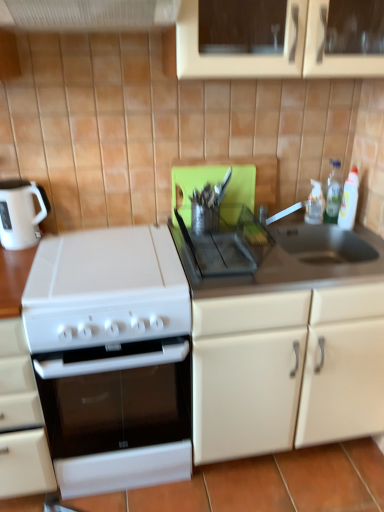
Question: Is point (1, 367) closer or farther from the camera than point (205, 423)?

Choices:
 (A) closer
 (B) farther

Answer: (A)

Question: Is white matte oven at lower left, the 1th cabinetry viewed from the left, inside the boundaries of white matte cabinet at right, positioned as the 1th cabinetry in right-to-left order, or outside?

Choices:
 (A) outside
 (B) inside

Answer: (A)

Question: Which of these objects is positioned closest to the white glossy gas stove at left, the second gas stove positioned from the top?

Choices:
 (A) white matte cabinet at right, positioned as the 1th cabinetry in right-to-left order
 (B) clear plastic bottle at upper right, which ranks as the 2th bottle in right-to-left order
 (C) white glossy electric kettle at left
 (D) white matte oven at lower left, the 1th cabinetry viewed from the left
 (E) white plastic bottle at upper right, the first bottle in the right-to-left sequence

Answer: (D)

Question: Which object is positioned closest to the white matte cabinet at right, positioned as the 1th cabinetry in right-to-left order?

Choices:
 (A) white plastic bottle at upper right, the first bottle in the right-to-left sequence
 (B) white plastic exhaust hood at upper center
 (C) black plastic tray at center, the second gas stove in the left-to-right sequence
 (D) white glossy electric kettle at left
 (E) white matte oven at lower left, the 1th cabinetry viewed from the left

Answer: (C)